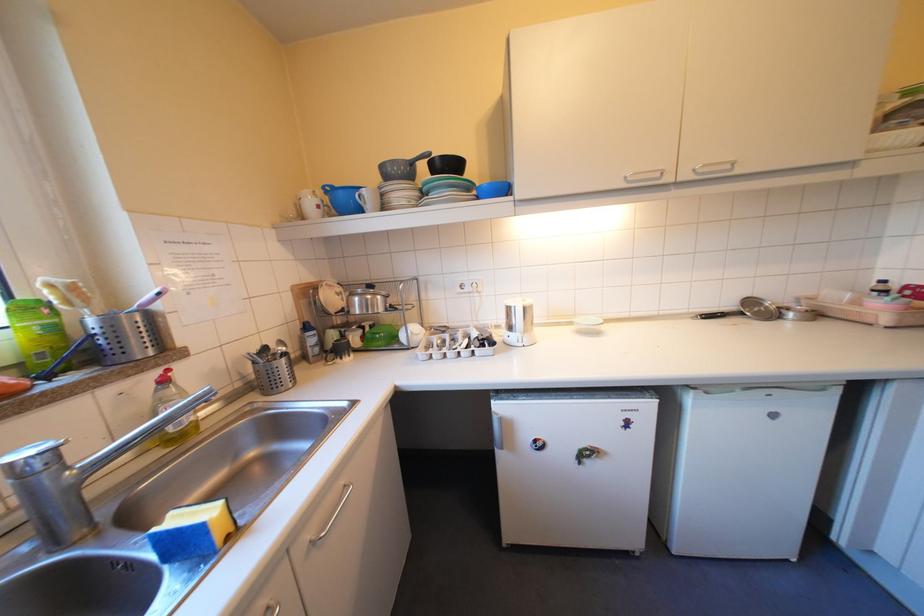
This screenshot has height=616, width=924. I want to click on pot lid handle, so click(x=400, y=168).